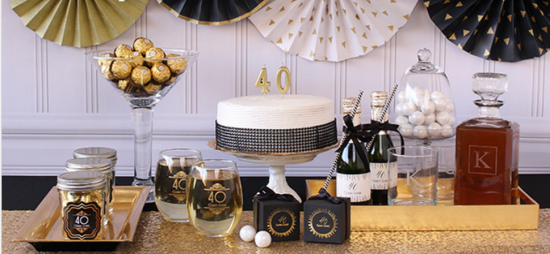
The image size is (550, 254). In order to click on wall ornament in this screenshot , I will do `click(91, 19)`, `click(223, 12)`, `click(335, 21)`, `click(500, 34)`.